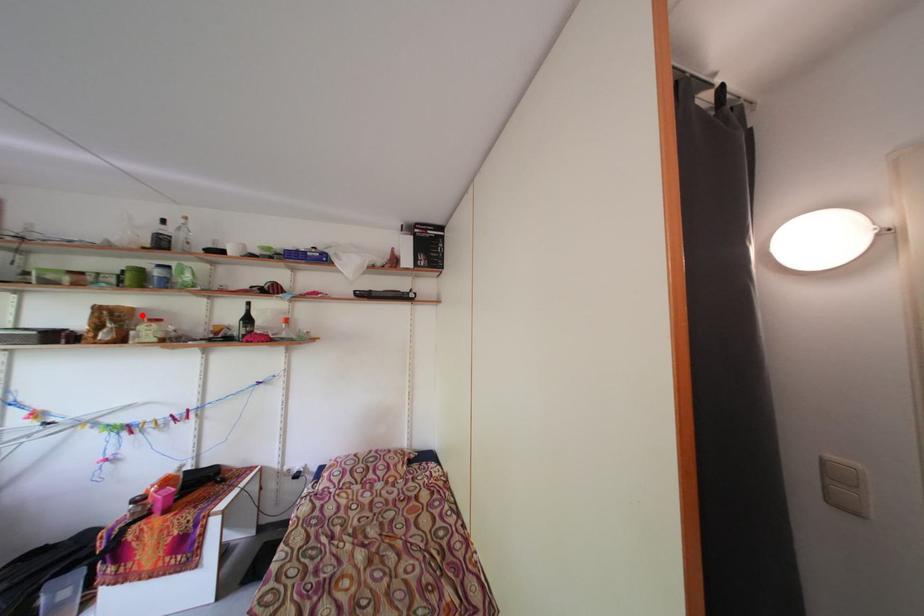
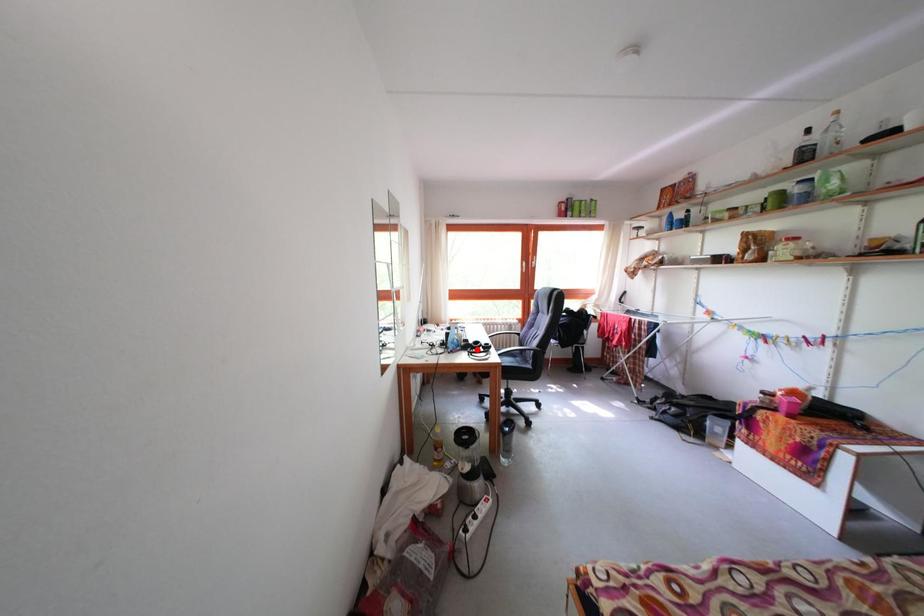
I am providing you with two images of the same scene from different viewpoints. A red point is marked on the first image and another point is marked on the second image. Are the points marked in image1 and image2 representing the same 3D position?

No